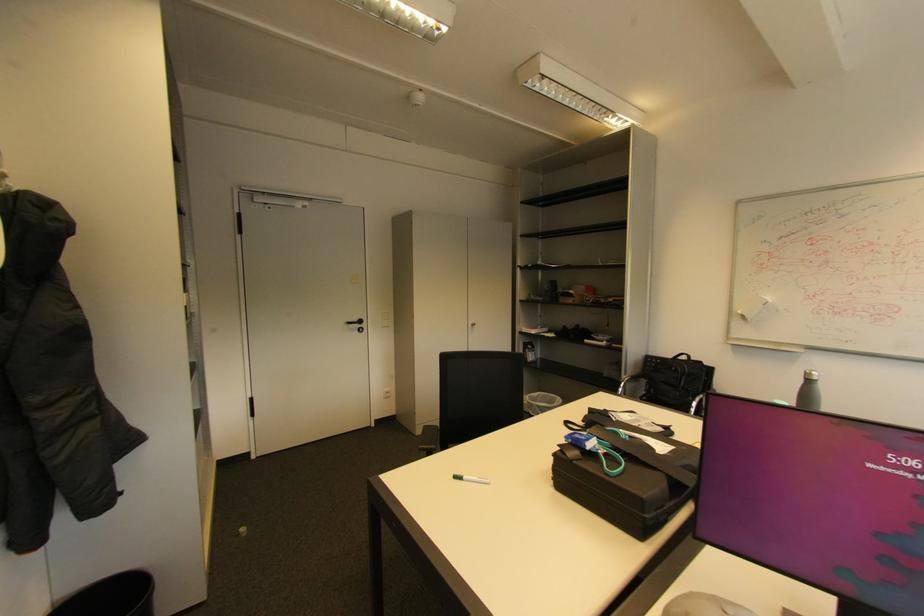
Image resolution: width=924 pixels, height=616 pixels. What are the coordinates of `silver cabinet handle` in the screenshot? It's located at (475, 323).